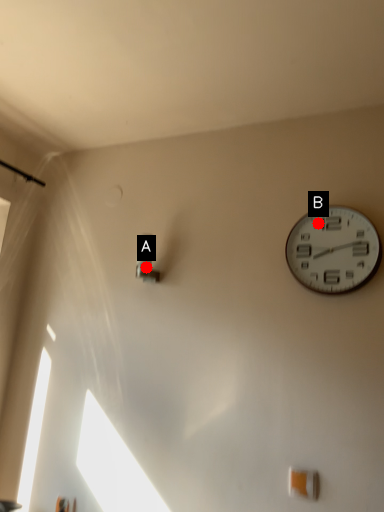
Question: Two points are circled on the image, labeled by A and B beside each circle. Which point is further to the camera?

Choices:
 (A) A is further
 (B) B is further

Answer: (A)